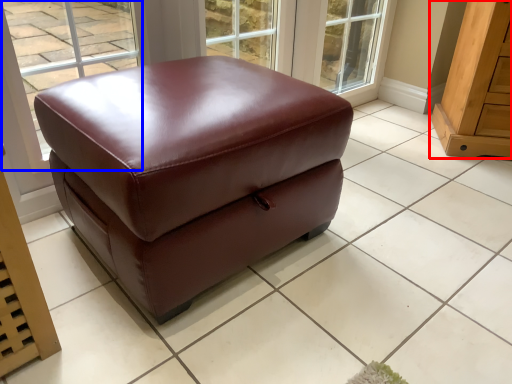
Question: Among these objects, which one is nearest to the camera, furniture (highlighted by a red box) or window (highlighted by a blue box)?

Choices:
 (A) furniture
 (B) window

Answer: (B)